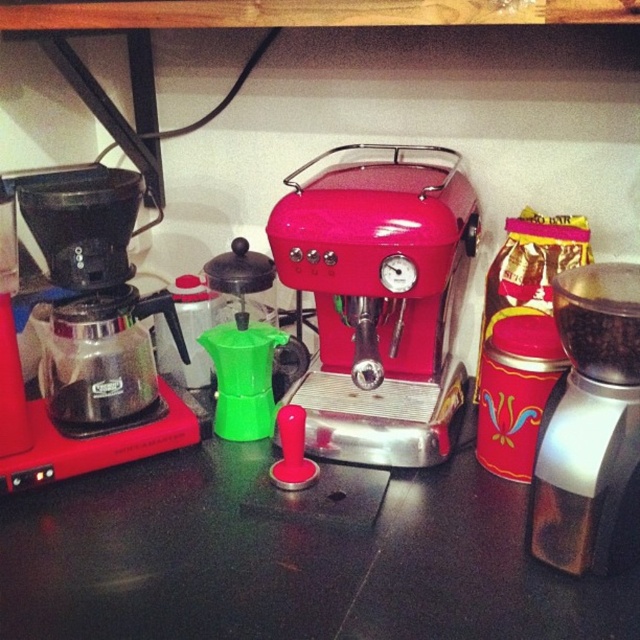
You are a barista who needs to reach both the glossy metallic espresso machine at center and the metallic silver grinder at center. If your arm can extend 10 inches, can you comfortably reach both items without moving your body?

The glossy metallic espresso machine at center is 9.53 inches away from the metallic silver grinder at center. Since your arm can extend 10 inches, you can comfortably reach both items without moving your body.

You are setting up a coffee station and want to place a new coffee bean container between the glossy metallic espresso machine at center and the metallic silver grinder at center. Given that the container is 15 cm wide, can it fit in the space between them?

The glossy metallic espresso machine at center is wider than the metallic silver grinder at center. However, the exact width difference isn